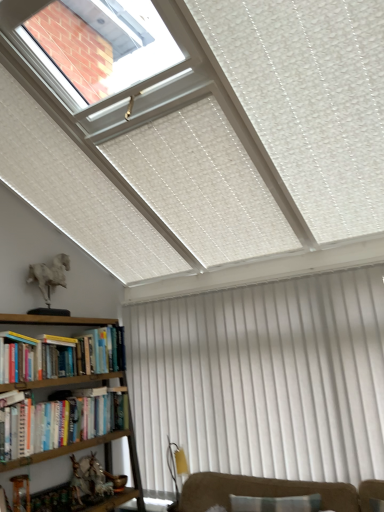
Question: Would you say white plastic skylight at upper left is to the left or to the right of white textured curtain at lower right in the picture?

Choices:
 (A) left
 (B) right

Answer: (A)

Question: Is white plastic skylight at upper left bigger or smaller than white textured curtain at lower right?

Choices:
 (A) small
 (B) big

Answer: (B)

Question: Estimate the real-world distances between objects in this image. Which object is farther from the hardcover book at left, positioned as the second book in bottom-to-top order?

Choices:
 (A) white plastic skylight at upper left
 (B) hardcover book at left, which ranks as the 1th book in top-to-bottom order
 (C) wooden bookshelf at lower left
 (D) white textured curtain at lower right
 (E) hardcover book at lower left, positioned as the 1th book in bottom-to-top order

Answer: (A)

Question: Estimate the real-world distances between objects in this image. Which object is closer to the white textured curtain at lower right?

Choices:
 (A) hardcover book at left, the second book in the top-to-bottom sequence
 (B) wooden bookshelf at lower left
 (C) hardcover book at left, which ranks as the 1th book in top-to-bottom order
 (D) white plastic skylight at upper left
 (E) hardcover book at lower left, the 3th book positioned from the top

Answer: (A)